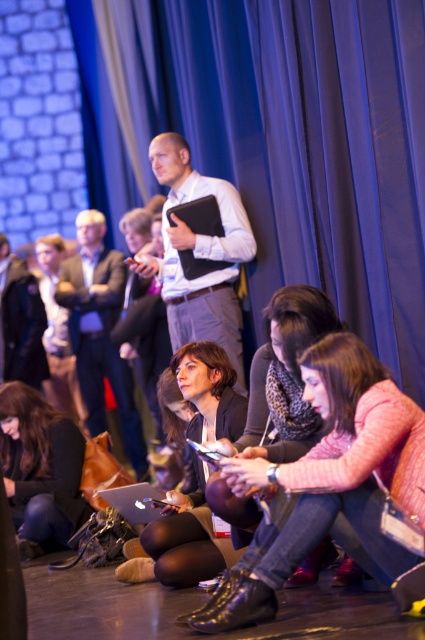
Does blue fabric curtain at upper center appear under matte black laptop at center?

No, blue fabric curtain at upper center is not below matte black laptop at center.

Is point (246, 161) positioned before point (198, 481)?

No, (246, 161) is further to viewer.

The width and height of the screenshot is (425, 640). I want to click on blue fabric curtain at upper center, so click(280, 140).

Can you confirm if white glossy shirt at center is bigger than matte black laptop at lower left?

Yes, white glossy shirt at center is bigger than matte black laptop at lower left.

Can you confirm if white glossy shirt at center is thinner than matte black laptop at lower left?

In fact, white glossy shirt at center might be wider than matte black laptop at lower left.

Who is more distant from viewer, (187, 234) or (53, 465)?

The point (187, 234) is behind.

You are a GUI agent. You are given a task and a screenshot of the screen. Output one action in this format:
    pyautogui.click(x=<x>, y=<y>)
    Task: Click on the white glossy shirt at center
    The height and width of the screenshot is (640, 425).
    Given the screenshot: What is the action you would take?
    pyautogui.click(x=198, y=256)

Is pink matte sweater at lower center shorter than white glossy shirt at center?

Indeed, pink matte sweater at lower center has a lesser height compared to white glossy shirt at center.

Who is positioned more to the left, pink matte sweater at lower center or white glossy shirt at center?

white glossy shirt at center

Describe the element at coordinates (334, 477) in the screenshot. This screenshot has width=425, height=640. I see `pink matte sweater at lower center` at that location.

The height and width of the screenshot is (640, 425). Find the location of `pink matte sweater at lower center`. pink matte sweater at lower center is located at coordinates (334, 477).